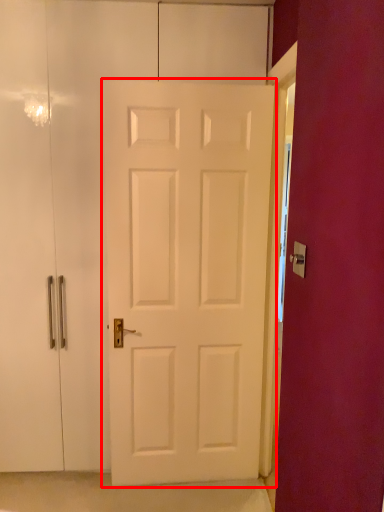
Question: Considering the relative positions of door (annotated by the red box) and door handle in the image provided, where is door (annotated by the red box) located with respect to the staircase?

Choices:
 (A) right
 (B) left

Answer: (B)